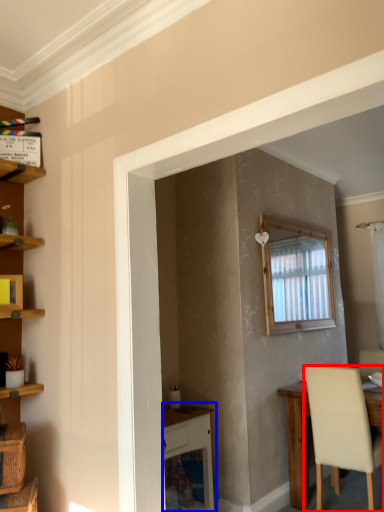
Question: Among these objects, which one is farthest to the camera, chair (highlighted by a red box) or vanity (highlighted by a blue box)?

Choices:
 (A) chair
 (B) vanity

Answer: (A)